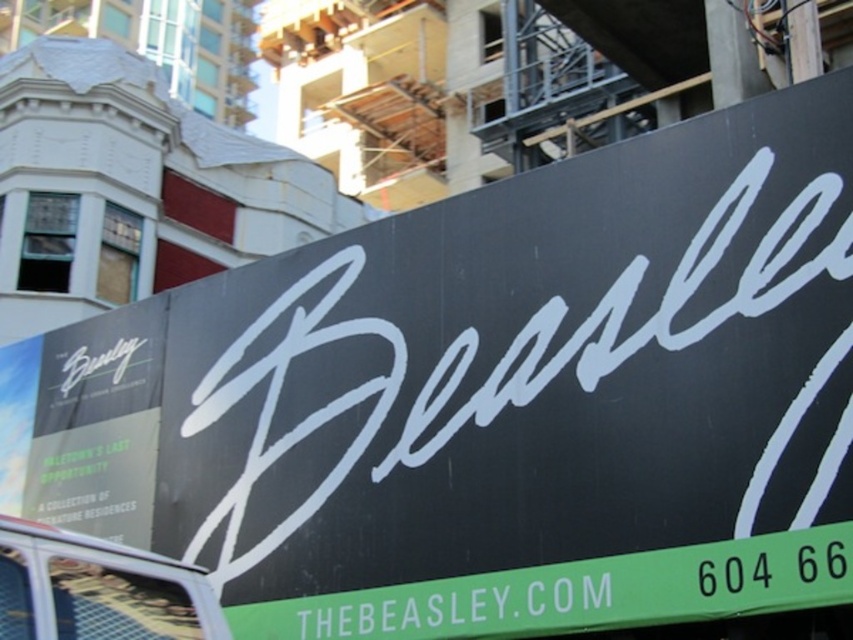
Question: Does green matte signboard at bottom have a larger size compared to metallic silver food truck at lower left?

Choices:
 (A) yes
 (B) no

Answer: (A)

Question: Considering the relative positions of green matte signboard at bottom and metallic silver food truck at lower left in the image provided, where is green matte signboard at bottom located with respect to metallic silver food truck at lower left?

Choices:
 (A) right
 (B) left

Answer: (A)

Question: Which object is closer to the camera taking this photo?

Choices:
 (A) metallic silver food truck at lower left
 (B) green matte signboard at bottom
 (C) matte white sign at left

Answer: (A)

Question: Can you confirm if green matte signboard at bottom is smaller than matte white sign at left?

Choices:
 (A) yes
 (B) no

Answer: (B)

Question: Among these points, which one is nearest to the camera?

Choices:
 (A) pos(97,406)
 (B) pos(801,554)

Answer: (B)

Question: Which point is closer to the camera taking this photo?

Choices:
 (A) (30, 632)
 (B) (126, 364)

Answer: (A)